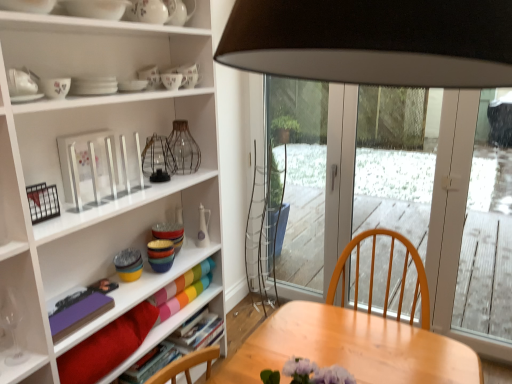
This screenshot has height=384, width=512. What do you see at coordinates (203, 227) in the screenshot?
I see `white ceramic vase at center, placed as the third tableware when sorted from bottom to top` at bounding box center [203, 227].

You are a GUI agent. You are given a task and a screenshot of the screen. Output one action in this format:
    pyautogui.click(x=<x>, y=<y>)
    Task: Click on the white ceramic vase at center, the 10th tableware in the top-to-bottom sequence
    
    Given the screenshot: What is the action you would take?
    [x=203, y=227]

This screenshot has height=384, width=512. Find the location of `transparent glass wine glass at lower left`. transparent glass wine glass at lower left is located at coordinates (13, 329).

Measure the distance between point (185, 84) and camera.

The depth of point (185, 84) is 6.43 feet.

Where is `white ceramic bowl at upper left, marked as the third tableware in a top-to-bottom arrangement`? white ceramic bowl at upper left, marked as the third tableware in a top-to-bottom arrangement is located at coordinates (29, 5).

In order to face porcelain plates at upper center, the fourth tableware viewed from the top, should I rotate leftwards or rightwards?

You should look left and rotate roughly 8.795 degrees.

Find the location of `white ceramic vase at center, placed as the third tableware when sorted from bottom to top`. white ceramic vase at center, placed as the third tableware when sorted from bottom to top is located at coordinates (203, 227).

Which point is more distant from viewer, (136,334) or (215,334)?

The point (215,334) is more distant.

Is velvet red cushion at lower left oriented towards hardcover book at lower center, which is counted as the 1th book, starting from the back?

No, velvet red cushion at lower left does not turn towards hardcover book at lower center, which is counted as the 1th book, starting from the back.

Is velvet red cushion at lower left not near hardcover book at lower center, which is counted as the 1th book, starting from the back?

They are positioned close to each other.

You are a GUI agent. You are given a task and a screenshot of the screen. Output one action in this format:
    pyautogui.click(x=<x>, y=<y>)
    Task: Click on the fabric on the left of white glossy plates at upper center, which appears as the 6th tableware when ordered from the bottom
    The height and width of the screenshot is (384, 512).
    Given the screenshot: What is the action you would take?
    pyautogui.click(x=106, y=346)

From the image's perspective, which one is positioned lower, white glossy plates at upper center, which appears as the seventh tableware when viewed from the top, or velvet red cushion at lower left?

velvet red cushion at lower left is shown below in the image.

From a real-world perspective, is white glossy plates at upper center, which appears as the seventh tableware when viewed from the top, positioned under velvet red cushion at lower left based on gravity?

Incorrect, from a real-world perspective, white glossy plates at upper center, which appears as the seventh tableware when viewed from the top, is higher than velvet red cushion at lower left.

Is white glossy plates at upper center, which appears as the seventh tableware when viewed from the top, wider than velvet red cushion at lower left?

No, white glossy plates at upper center, which appears as the seventh tableware when viewed from the top, is not wider than velvet red cushion at lower left.

Is white ceramic bowl at upper left, marked as the third tableware in a top-to-bottom arrangement, turned away from multicolored glass bowls at center, acting as the 2th tableware starting from the bottom?

No.

Are white ceramic bowl at upper left, which is the 10th tableware from bottom to top, and multicolored glass bowls at center, acting as the 2th tableware starting from the bottom, beside each other?

white ceramic bowl at upper left, which is the 10th tableware from bottom to top, is not next to multicolored glass bowls at center, acting as the 2th tableware starting from the bottom, and they're not touching.

Is white ceramic bowl at upper left, marked as the third tableware in a top-to-bottom arrangement, closer to the viewer compared to multicolored glass bowls at center, acting as the 2th tableware starting from the bottom?

Yes, the depth of white ceramic bowl at upper left, marked as the third tableware in a top-to-bottom arrangement, is less than that of multicolored glass bowls at center, acting as the 2th tableware starting from the bottom.

How distant is white ceramic bowl at upper left, marked as the third tableware in a top-to-bottom arrangement, from white glossy plates at upper center, which appears as the seventh tableware when viewed from the top?

11.51 inches.

Is white ceramic bowl at upper left, which is the 10th tableware from bottom to top, oriented towards white glossy plates at upper center, which appears as the 6th tableware when ordered from the bottom?

No, white ceramic bowl at upper left, which is the 10th tableware from bottom to top, is not oriented towards white glossy plates at upper center, which appears as the 6th tableware when ordered from the bottom.

From the image's perspective, relative to white glossy plates at upper center, which appears as the seventh tableware when viewed from the top, is white ceramic bowl at upper left, which is the 10th tableware from bottom to top, above or below?

From the image's perspective, white ceramic bowl at upper left, which is the 10th tableware from bottom to top, appears above white glossy plates at upper center, which appears as the seventh tableware when viewed from the top.

Based on the photo, between white ceramic bowl at upper left, which is the 10th tableware from bottom to top, and white glossy plates at upper center, which appears as the 6th tableware when ordered from the bottom, which one has larger size?

With larger size is white ceramic bowl at upper left, which is the 10th tableware from bottom to top.

Is matte red book at lower left, which is counted as the 2th book, starting from the front, at the right side of porcelain bowl at upper center, positioned as the eighth tableware in bottom-to-top order?

No.

Which of these two, matte red book at lower left, the 3th book from the back, or porcelain bowl at upper center, positioned as the eighth tableware in bottom-to-top order, is bigger?

With larger size is matte red book at lower left, the 3th book from the back.

Between matte red book at lower left, the 3th book from the back, and porcelain bowl at upper center, positioned as the eighth tableware in bottom-to-top order, which one is positioned in front?

matte red book at lower left, the 3th book from the back.

The height and width of the screenshot is (384, 512). Identify the location of book that is the 1st object located in front of the porcelain bowl at upper center, the 5th tableware in the top-to-bottom sequence. (150, 364).

Which is behind, point (88, 303) or point (37, 13)?

Positioned behind is point (88, 303).

Is purple matte book at lower left, acting as the first book starting from the front, outside of white ceramic bowl at upper left, which is the 10th tableware from bottom to top?

purple matte book at lower left, acting as the first book starting from the front, lies outside white ceramic bowl at upper left, which is the 10th tableware from bottom to top,'s area.

How many degrees apart are the facing directions of purple matte book at lower left, the 4th book when ordered from back to front, and white ceramic bowl at upper left, marked as the third tableware in a top-to-bottom arrangement?

The angular difference between purple matte book at lower left, the 4th book when ordered from back to front, and white ceramic bowl at upper left, marked as the third tableware in a top-to-bottom arrangement, is 1.21 degrees.

Is purple matte book at lower left, the 4th book when ordered from back to front, placed right next to white ceramic bowl at upper left, marked as the third tableware in a top-to-bottom arrangement?

No, purple matte book at lower left, the 4th book when ordered from back to front, is not with white ceramic bowl at upper left, marked as the third tableware in a top-to-bottom arrangement.

Is metallic wire basket at upper center, the fourth tableware ordered from the bottom, not within white ceramic vase at center, the 10th tableware in the top-to-bottom sequence?

Yes, metallic wire basket at upper center, the fourth tableware ordered from the bottom, is located beyond the bounds of white ceramic vase at center, the 10th tableware in the top-to-bottom sequence.

The image size is (512, 384). Identify the location of tableware that is the 6th object located in front of the white ceramic vase at center, placed as the third tableware when sorted from bottom to top. (157, 159).

Considering the sizes of objects metallic wire basket at upper center, the 9th tableware positioned from the top, and white ceramic vase at center, placed as the third tableware when sorted from bottom to top, in the image provided, who is shorter, metallic wire basket at upper center, the 9th tableware positioned from the top, or white ceramic vase at center, placed as the third tableware when sorted from bottom to top,?

Standing shorter between the two is metallic wire basket at upper center, the 9th tableware positioned from the top.

Is the depth of metallic wire basket at upper center, the 9th tableware positioned from the top, greater than that of white ceramic vase at center, the 10th tableware in the top-to-bottom sequence?

No, metallic wire basket at upper center, the 9th tableware positioned from the top, is closer to the viewer.

From the image's perspective, which book is the 1st one below the velvet red cushion at lower left? Please provide its 2D coordinates.

[(199, 331)]

The image size is (512, 384). I want to click on fabric on the left of white glossy plates at upper center, which appears as the 6th tableware when ordered from the bottom, so click(x=106, y=346).

Which object lies nearer to the anchor point white glossy plates at upper center, which appears as the 6th tableware when ordered from the bottom, porcelain plates at upper left, arranged as the 5th tableware when ordered from the bottom, or velvet red cushion at lower left?

Based on the image, porcelain plates at upper left, arranged as the 5th tableware when ordered from the bottom, appears to be nearer to white glossy plates at upper center, which appears as the 6th tableware when ordered from the bottom.

Looking at the image, which one is located further to white glossy vase at upper center, which appears as the first tableware when viewed from the top, metallic wire basket at upper center, the 9th tableware positioned from the top, or porcelain plates at upper center, which is the ninth tableware from bottom to top?

Among the two, metallic wire basket at upper center, the 9th tableware positioned from the top, is located further to white glossy vase at upper center, which appears as the first tableware when viewed from the top.

Based on their spatial positions, is white glossy plates at upper center, which appears as the 6th tableware when ordered from the bottom, or multicolored ceramic bowls at center, the 1th tableware positioned from the bottom, further from white glossy bowl at upper center, the second tableware in the top-to-bottom sequence?

multicolored ceramic bowls at center, the 1th tableware positioned from the bottom, is further to white glossy bowl at upper center, the second tableware in the top-to-bottom sequence.

Looking at the image, which one is located further to velvet red cushion at lower left, white glossy vase at upper center, the twelfth tableware in the bottom-to-top sequence, or white ceramic bowl at upper left, which is the 10th tableware from bottom to top?

white glossy vase at upper center, the twelfth tableware in the bottom-to-top sequence, is positioned further to the anchor velvet red cushion at lower left.

Estimate the real-world distances between objects in this image. Which object is closer to matte ceramic cup at upper center, the 7th tableware in the bottom-to-top sequence, transparent glass vase at center or white glossy plates at upper center, which appears as the seventh tableware when viewed from the top?

transparent glass vase at center is closer to matte ceramic cup at upper center, the 7th tableware in the bottom-to-top sequence.

Considering their positions, is porcelain bowl at upper center, the 5th tableware in the top-to-bottom sequence, positioned further to white ceramic bowl at upper left, which is the 10th tableware from bottom to top, than white ceramic vase at center, the 10th tableware in the top-to-bottom sequence?

white ceramic vase at center, the 10th tableware in the top-to-bottom sequence, lies further to white ceramic bowl at upper left, which is the 10th tableware from bottom to top, than the other object.

From the image, which object appears to be farther from matte plastic book at lower center, which is the third book in front-to-back order, white ceramic vase at center, the 10th tableware in the top-to-bottom sequence, or white ceramic bowl at upper left, which is the 10th tableware from bottom to top?

white ceramic bowl at upper left, which is the 10th tableware from bottom to top.

In the scene shown: Which object lies further to the anchor point matte plastic book at lower center, which is the third book in front-to-back order, white ceramic vase at center, placed as the third tableware when sorted from bottom to top, or transparent glass wine glass at lower left?

transparent glass wine glass at lower left is further to matte plastic book at lower center, which is the third book in front-to-back order.

I want to click on wine glass between white ceramic bowl at upper left, which is the 10th tableware from bottom to top, and velvet red cushion at lower left in the up-down direction, so click(x=13, y=329).

You are a GUI agent. You are given a task and a screenshot of the screen. Output one action in this format:
    pyautogui.click(x=<x>, y=<y>)
    Task: Click on the fabric that lies between porcelain bowl at upper center, the 5th tableware in the top-to-bottom sequence, and matte red book at lower left, which is counted as the 2th book, starting from the front, from top to bottom
    The width and height of the screenshot is (512, 384).
    Given the screenshot: What is the action you would take?
    pyautogui.click(x=106, y=346)

Find the location of a particular element. fabric between metallic wire basket at upper center, the 9th tableware positioned from the top, and matte red book at lower left, which is counted as the 2th book, starting from the front, from top to bottom is located at coordinates (106, 346).

What are the coordinates of `fabric positioned between transparent glass wine glass at lower left and matte red book at lower left, the 3th book from the back, from near to far` in the screenshot? It's located at (106, 346).